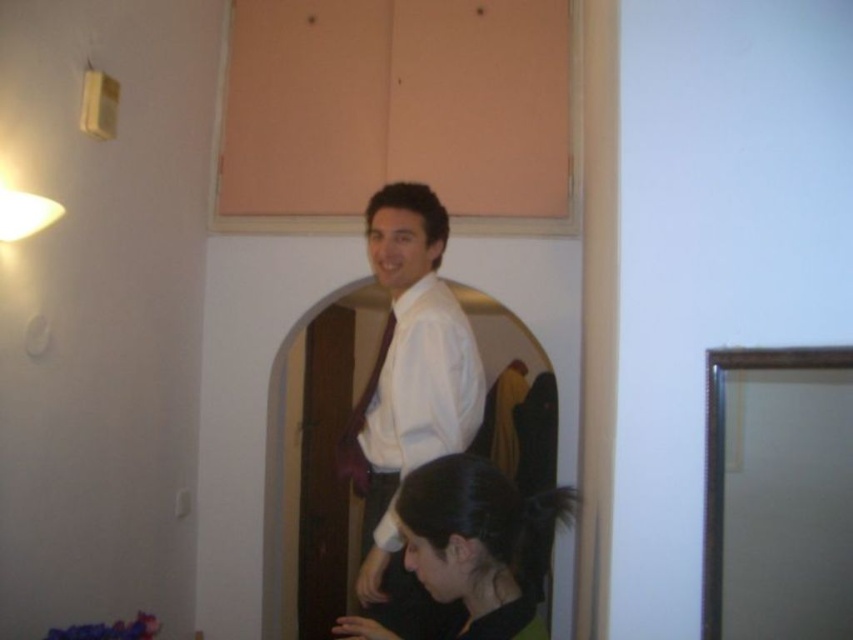
Question: Which object appears closest to the camera in this image?

Choices:
 (A) white glossy shirt at center
 (B) black matte hair at center

Answer: (B)

Question: Does white glossy shirt at center appear over matte brown tie at center?

Choices:
 (A) yes
 (B) no

Answer: (A)

Question: Estimate the real-world distances between objects in this image. Which object is closer to the white glossy shirt at center?

Choices:
 (A) matte brown tie at center
 (B) black matte hair at center

Answer: (A)

Question: Among these objects, which one is nearest to the camera?

Choices:
 (A) matte brown tie at center
 (B) white glossy shirt at center

Answer: (B)

Question: Does white glossy shirt at center appear under matte brown tie at center?

Choices:
 (A) yes
 (B) no

Answer: (B)

Question: Considering the relative positions of black matte hair at center and matte brown tie at center in the image provided, where is black matte hair at center located with respect to matte brown tie at center?

Choices:
 (A) left
 (B) right

Answer: (B)